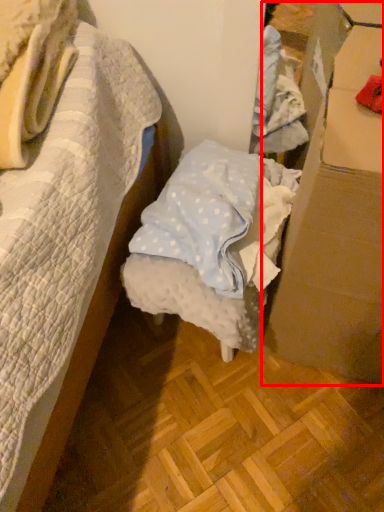
Question: In this image, where is cardboard box (annotated by the red box) located relative to furniture?

Choices:
 (A) right
 (B) left

Answer: (A)